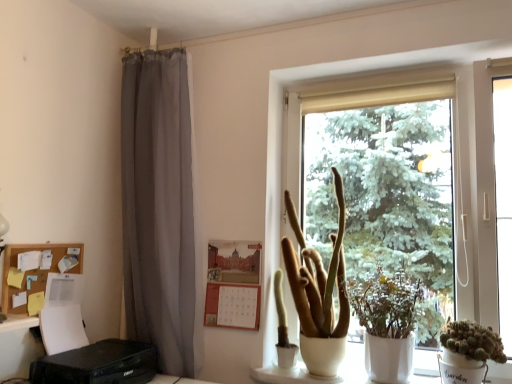
Question: Is white matte window at center in front of or behind corkboard paper at left in the image?

Choices:
 (A) front
 (B) behind

Answer: (A)

Question: Looking at their shapes, would you say white matte window at center is wider or thinner than corkboard paper at left?

Choices:
 (A) thin
 (B) wide

Answer: (B)

Question: Which object is positioned farthest from the green matte cactus at center?

Choices:
 (A) corkboard paper at left
 (B) white matte cactus at right, which ranks as the third houseplant in left-to-right order
 (C) white matte window at center
 (D) green matte plant at center, the second houseplant viewed from the left
 (E) matte white pot at center, the first houseplant in the left-to-right sequence

Answer: (A)

Question: Which object is positioned closest to the matte white pot at center, the first houseplant in the left-to-right sequence?

Choices:
 (A) green matte plant at center, the second houseplant viewed from the left
 (B) green matte cactus at center
 (C) white matte cactus at right, which is the first houseplant from right to left
 (D) corkboard paper at left
 (E) white matte window at center

Answer: (A)